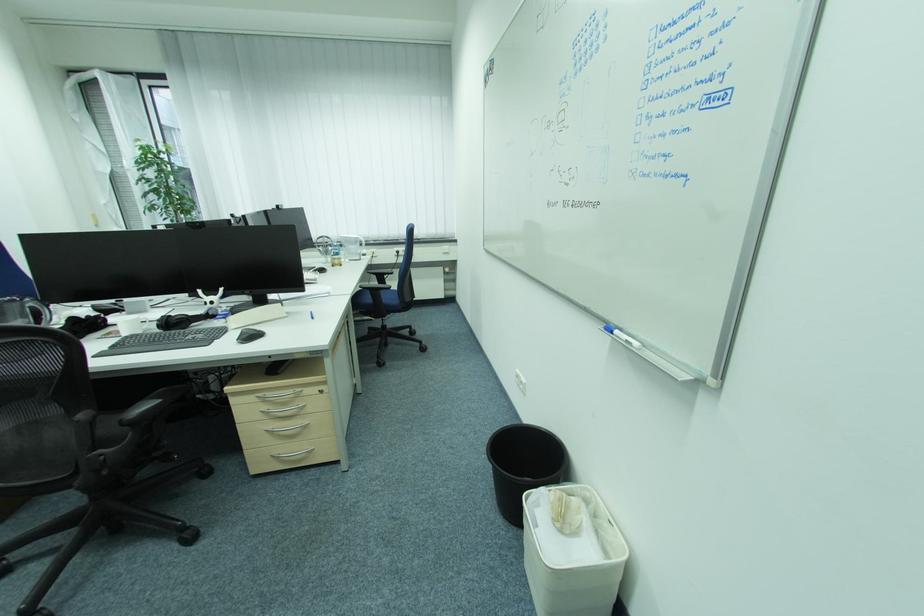
Locate an element on the screen. This screenshot has width=924, height=616. computer mouse is located at coordinates (249, 334).